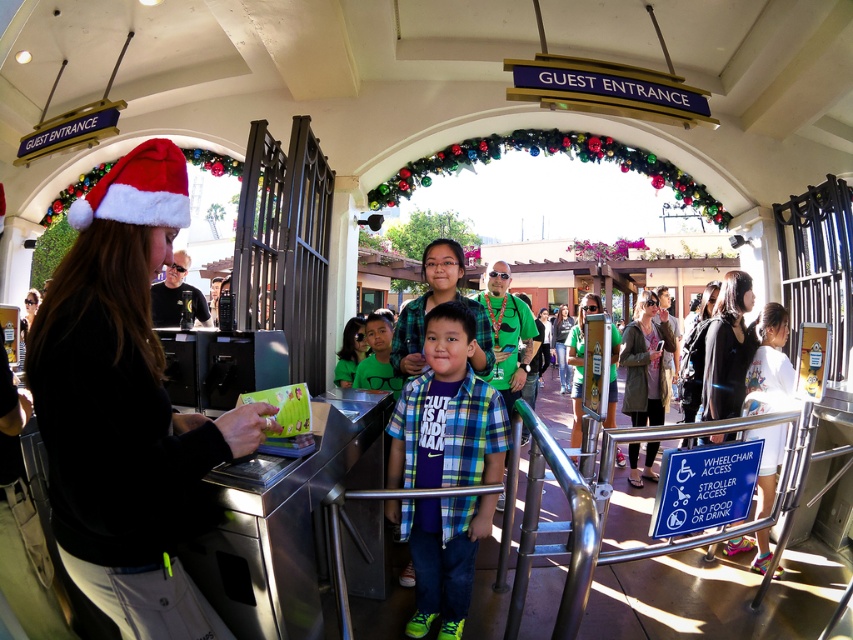
You are a guest at the theme park entrance and want to know if the Santa hat at center is above the Plaid shirt at center. Can you confirm this?

Yes, the Santa hat at center is positioned over the Plaid shirt at center, so it is indeed above it.

You are standing at the entrance of the theme park and want to take a photo of the two points mentioned. Which point, point (164,531) or point (469,314), will appear larger in your photo?

Point (164,531) will appear larger in the photo because it is closer to the camera than point (469,314).

You are a visitor at the theme park entrance and want to place your 12 inch tall backpack on the ground between the santa hat at center and the turnstile. Is there enough space for the backpack to fit between them?

The distance between the santa hat at center and the turnstile is 24.72 inches. Since the backpack is 12 inches tall, there is sufficient space to place it between them as the distance is greater than the backpack height.